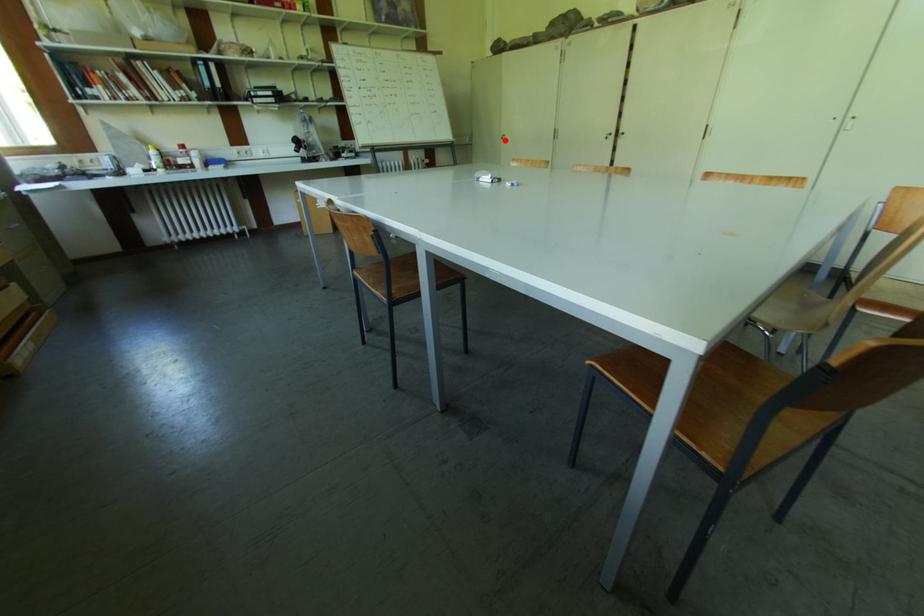
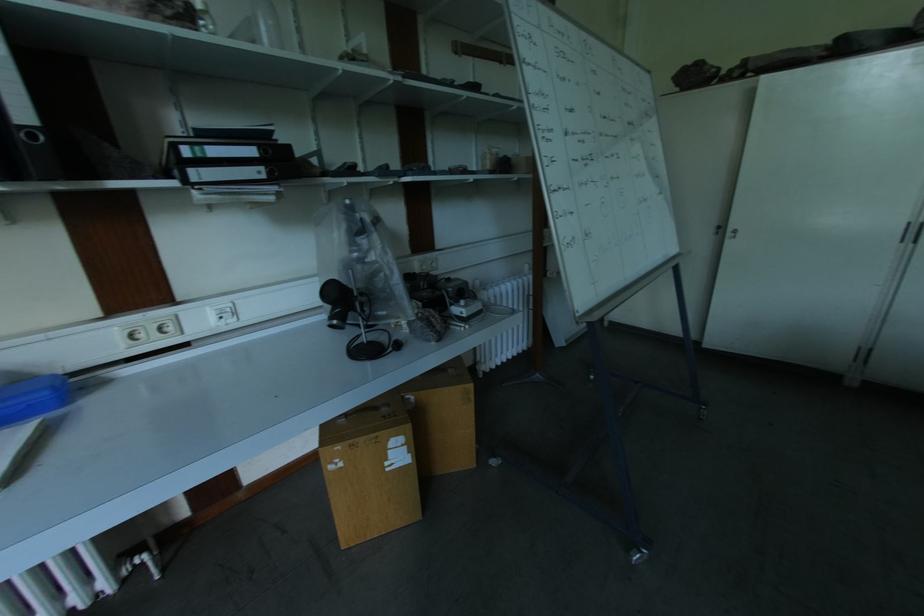
Question: I am providing you with two images of the same scene from different viewpoints. In image1, a red point is highlighted. Considering the same 3D point in image2, which of the following is correct?

Choices:
 (A) It is closer
 (B) It is farther

Answer: (B)